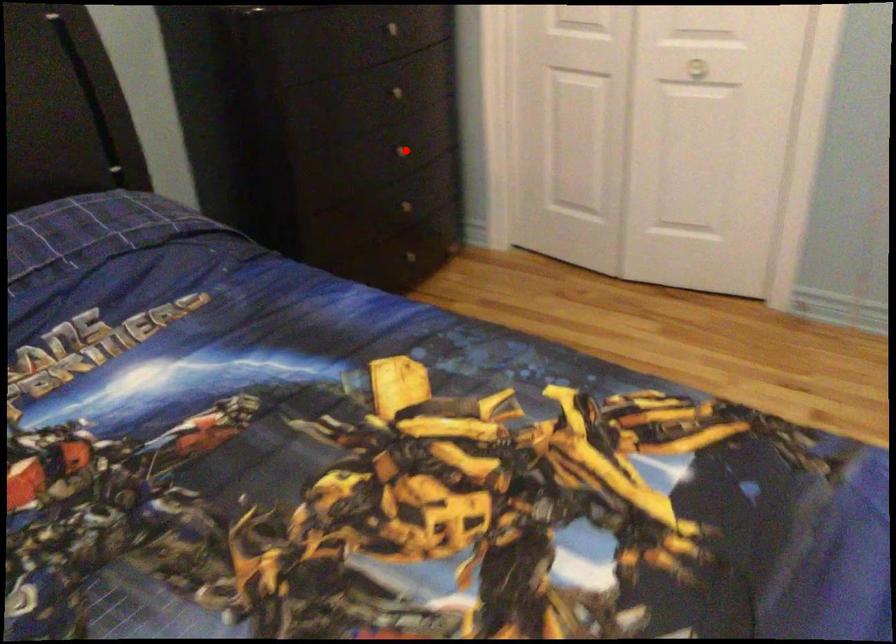
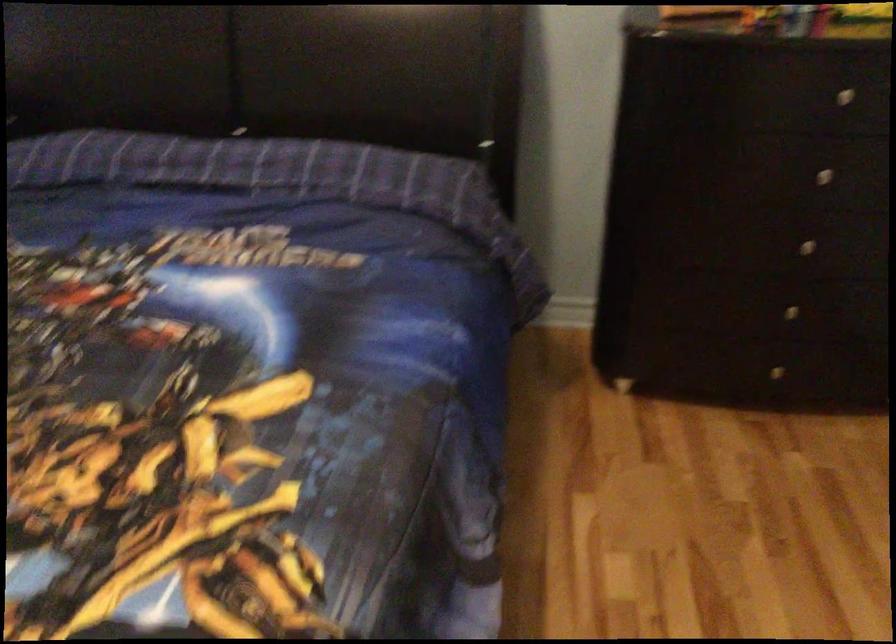
Where in the second image is the point corresponding to the highlighted location from the first image?

(805, 245)